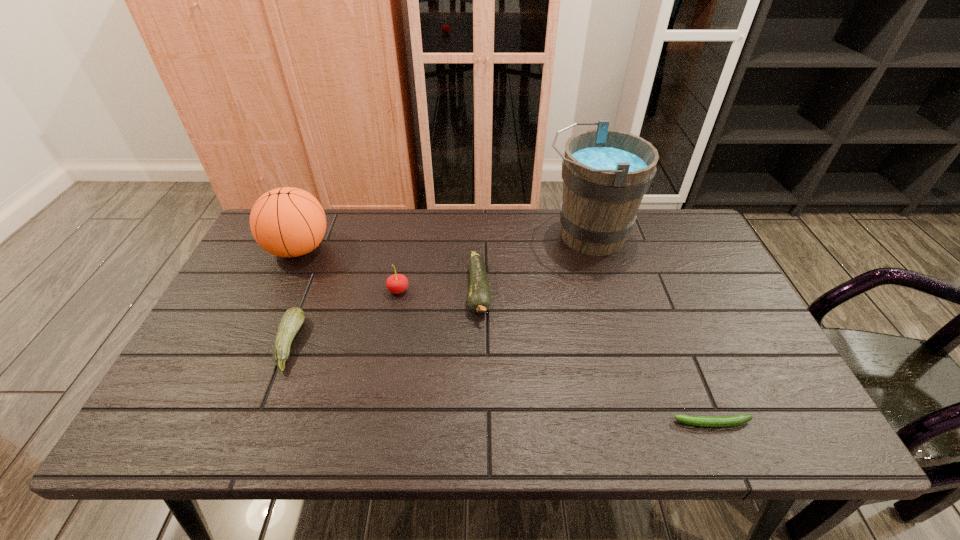
The height and width of the screenshot is (540, 960). In order to click on free space between the basketball and the second zucchini from right to left in this screenshot , I will do `click(389, 270)`.

The width and height of the screenshot is (960, 540). In order to click on blank region between the fifth shortest object and the third object from right to left in this screenshot , I will do 389,270.

Locate an element on the screen. The image size is (960, 540). vacant space in between the tallest object and the fifth tallest object is located at coordinates (438, 289).

I want to click on empty space between the basketball and the shortest object, so click(x=506, y=336).

Locate an element on the screen. unoccupied area between the rightmost zucchini and the basketball is located at coordinates (x=506, y=336).

Locate an element on the screen. free area in between the third shortest object and the tallest object is located at coordinates (534, 263).

At what (x,y) coordinates should I click in order to perform the action: click on free spot between the second tallest object and the fourth object from left to right. Please return your answer as a coordinate pair (x, y). The width and height of the screenshot is (960, 540). Looking at the image, I should click on (389, 270).

What are the coordinates of `vacant area that lies between the wine bucket and the cherry` in the screenshot? It's located at (492, 262).

Locate an element on the screen. empty space between the tallest object and the rightmost zucchini is located at coordinates point(650,329).

Where is `vacant area between the nearest object and the third tallest object`? vacant area between the nearest object and the third tallest object is located at coordinates (556, 356).